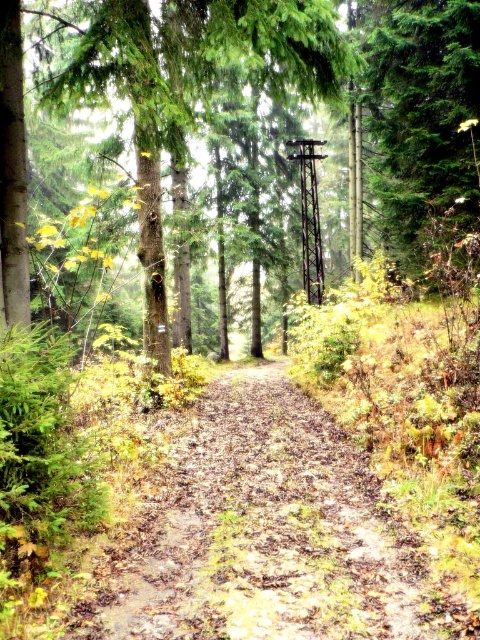
Question: Where is brown dirt path at center located in relation to green matte tree at center in the image?

Choices:
 (A) below
 (B) above

Answer: (A)

Question: Does brown dirt path at center appear on the right side of green matte tree at center?

Choices:
 (A) no
 (B) yes

Answer: (A)

Question: Which of the following is the closest to the observer?

Choices:
 (A) (3, 35)
 (B) (282, 499)

Answer: (A)

Question: Can you confirm if brown dirt path at center is thinner than green matte tree at center?

Choices:
 (A) no
 (B) yes

Answer: (B)